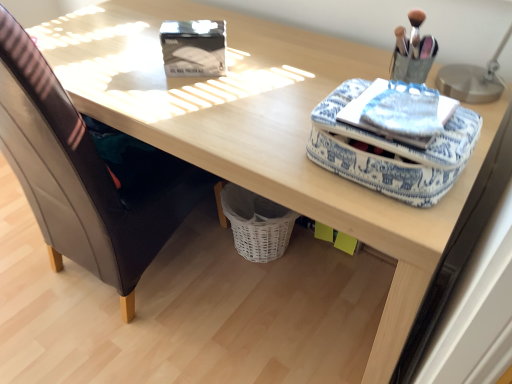
What are the coordinates of `free space above blue fabric case at upper right (from a real-world perspective)` in the screenshot? It's located at (406, 107).